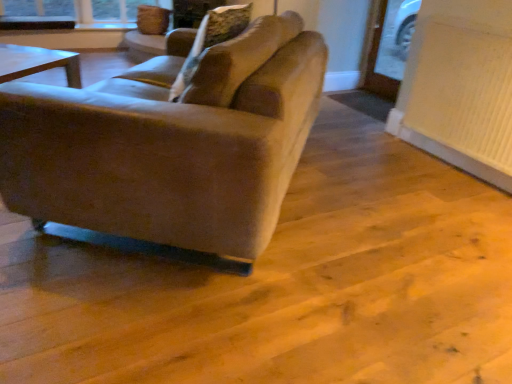
At what (x,y) coordinates should I click in order to perform the action: click on vacant space underneath white textured radiator at lower right (from a real-world perspective). Please return your answer as a coordinate pair (x, y). Looking at the image, I should click on (451, 160).